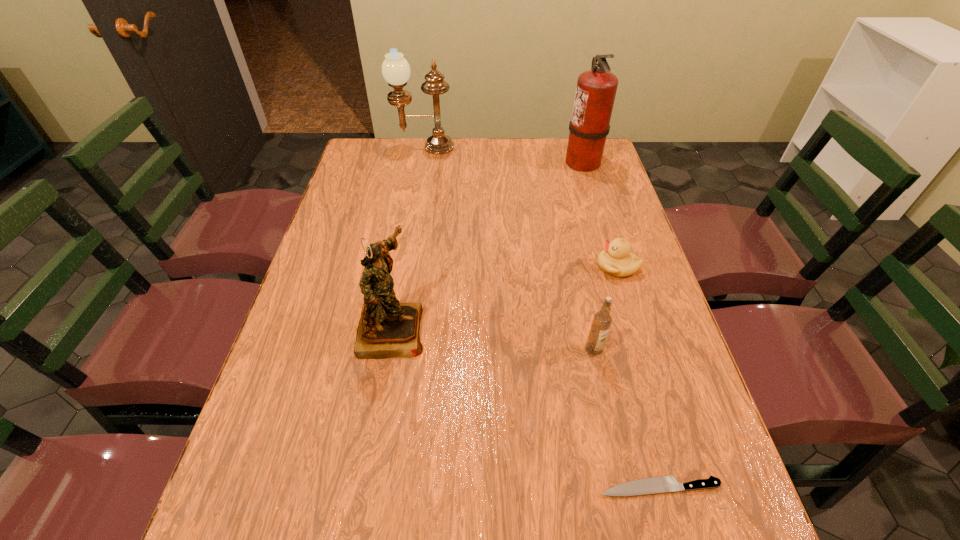
This screenshot has width=960, height=540. What are the coordinates of `fire extinguisher` in the screenshot? It's located at (596, 89).

Locate an element on the screen. This screenshot has height=540, width=960. oil lamp is located at coordinates (395, 69).

The height and width of the screenshot is (540, 960). I want to click on figurine, so tap(387, 328).

Locate an element on the screen. the third shortest object is located at coordinates (602, 320).

Locate an element on the screen. This screenshot has width=960, height=540. the fifth tallest object is located at coordinates (616, 259).

What are the coordinates of `duckling` in the screenshot? It's located at (616, 259).

This screenshot has height=540, width=960. I want to click on steak knife, so click(661, 484).

Find the location of a particular element. The width and height of the screenshot is (960, 540). the nearest object is located at coordinates (661, 484).

Identify the location of blank space located toward the nozzle of the fire extinguisher. The width and height of the screenshot is (960, 540). (479, 161).

Locate an element on the screen. The height and width of the screenshot is (540, 960). free point located toward the nozzle of the fire extinguisher is located at coordinates (496, 161).